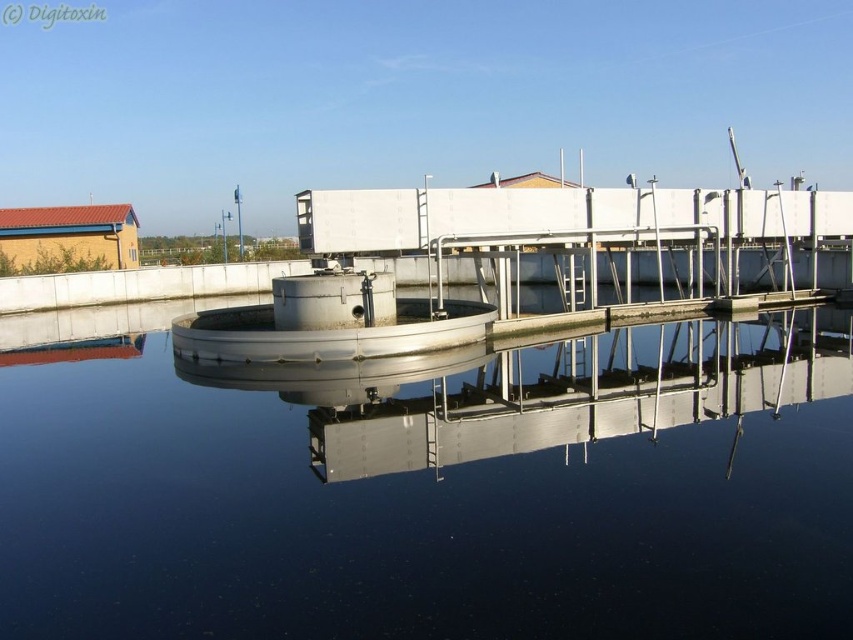
Measure the distance between metallic water at center and camera.

A distance of 4.21 meters exists between metallic water at center and camera.

Which is behind, point (479, 408) or point (780, 390)?

The point (780, 390) is more distant.

Is point (564, 378) behind point (498, 387)?

Yes, point (564, 378) is behind point (498, 387).

I want to click on metallic water at center, so click(x=428, y=486).